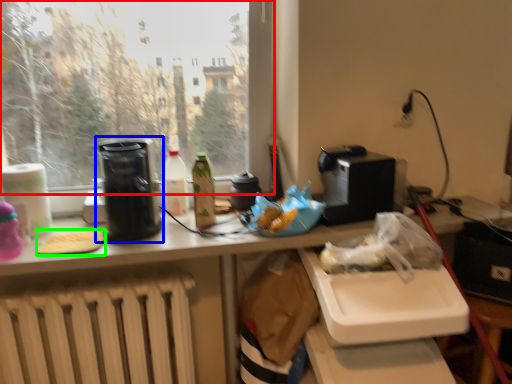
Question: Based on their relative distances, which object is nearer to window (highlighted by a red box)? Choose from kitchen appliance (highlighted by a blue box) and food (highlighted by a green box).

Choices:
 (A) kitchen appliance
 (B) food

Answer: (A)